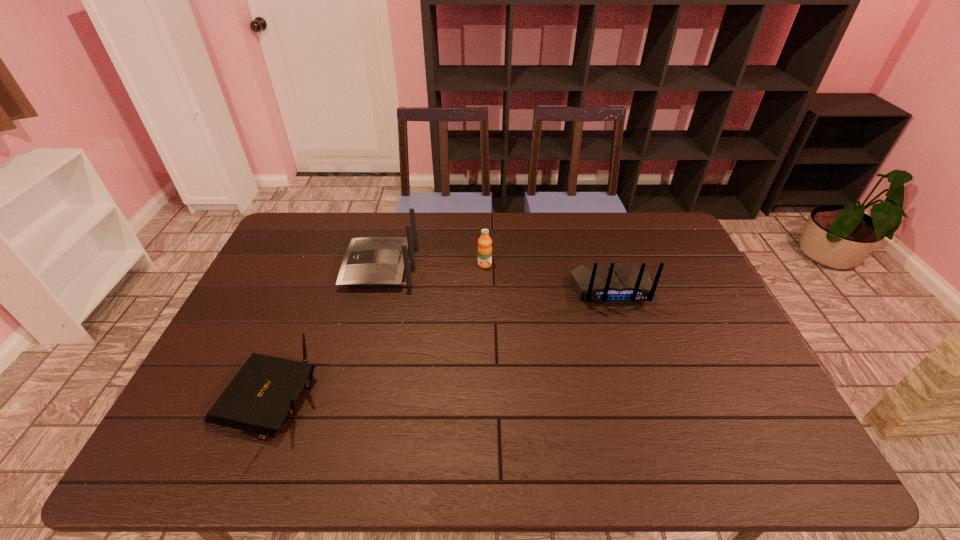
Where is `object located in the left edge section of the desktop`? object located in the left edge section of the desktop is located at coordinates (257, 400).

This screenshot has height=540, width=960. I want to click on object located in the near left corner section of the desktop, so click(257, 400).

The height and width of the screenshot is (540, 960). I want to click on vacant area at the far edge, so click(x=572, y=213).

In the image, there is a desktop. At what (x,y) coordinates should I click in order to perform the action: click on vacant space at the near edge. Please return your answer as a coordinate pair (x, y). This screenshot has height=540, width=960. Looking at the image, I should click on (330, 442).

Where is `vacant space at the left edge`? The width and height of the screenshot is (960, 540). vacant space at the left edge is located at coordinates pos(265,291).

You are a GUI agent. You are given a task and a screenshot of the screen. Output one action in this format:
    pyautogui.click(x=<x>, y=<y>)
    Task: Click on the vacant space at the right edge of the desktop
    This screenshot has height=540, width=960.
    Given the screenshot: What is the action you would take?
    pyautogui.click(x=687, y=278)

Locate an element on the screen. The image size is (960, 540). vacant point located between the second object from right to left and the shortest router is located at coordinates (376, 334).

Locate an element on the screen. This screenshot has height=540, width=960. unoccupied position between the rightmost router and the second shortest object is located at coordinates (548, 276).

Locate an element on the screen. Image resolution: width=960 pixels, height=540 pixels. free spot between the shortest object and the rightmost router is located at coordinates (440, 346).

I want to click on free space between the orange juice and the rightmost router, so click(x=548, y=276).